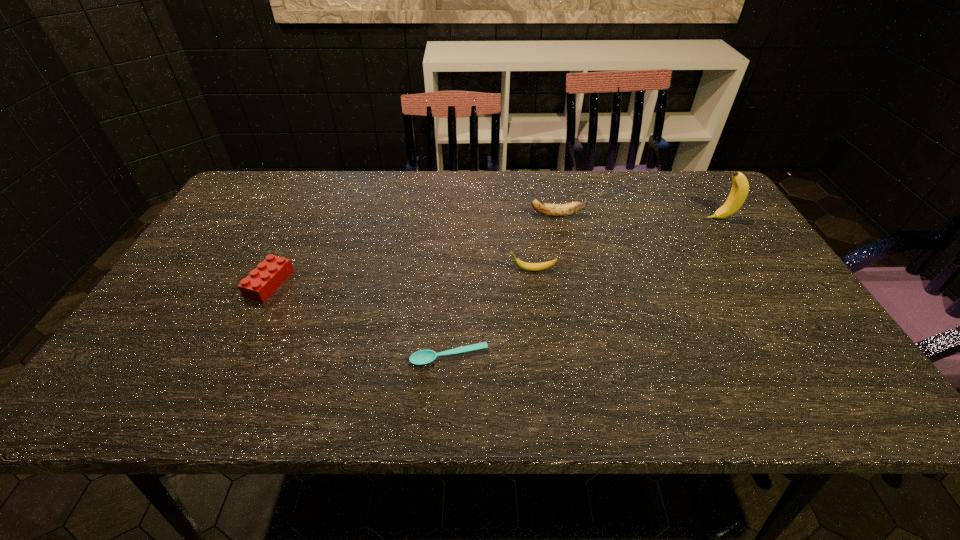
Locate an element on the screen. The image size is (960, 540). empty space between the second tallest banana and the rightmost object is located at coordinates (637, 217).

Image resolution: width=960 pixels, height=540 pixels. Find the location of `vacant area that lies between the leftmost object and the shortest object`. vacant area that lies between the leftmost object and the shortest object is located at coordinates [359, 320].

The height and width of the screenshot is (540, 960). I want to click on unoccupied position between the shortest object and the fourth tallest object, so click(x=359, y=320).

Where is `free spot between the shortest banana and the leftmost object`? The image size is (960, 540). free spot between the shortest banana and the leftmost object is located at coordinates pos(401,277).

Locate an element on the screen. The height and width of the screenshot is (540, 960). free space between the shortest banana and the spoon is located at coordinates (491, 314).

The image size is (960, 540). I want to click on empty location between the second tallest object and the leftmost object, so click(413, 249).

Find the location of a particular element. This screenshot has height=540, width=960. unoccupied area between the leftmost object and the rightmost object is located at coordinates (494, 252).

Choose which object is the fourth nearest neighbor to the rightmost object. Please provide its 2D coordinates. Your answer should be formatted as a tuple, i.e. [(x, y)], where the tuple contains the x and y coordinates of a point satisfying the conditions above.

[(268, 276)]

Where is `object that is the second closest to the shortest banana`? The image size is (960, 540). object that is the second closest to the shortest banana is located at coordinates (423, 357).

Locate which banana ranks in proximity to the second tallest object. Please provide its 2D coordinates. Your answer should be formatted as a tuple, i.e. [(x, y)], where the tuple contains the x and y coordinates of a point satisfying the conditions above.

[(522, 265)]